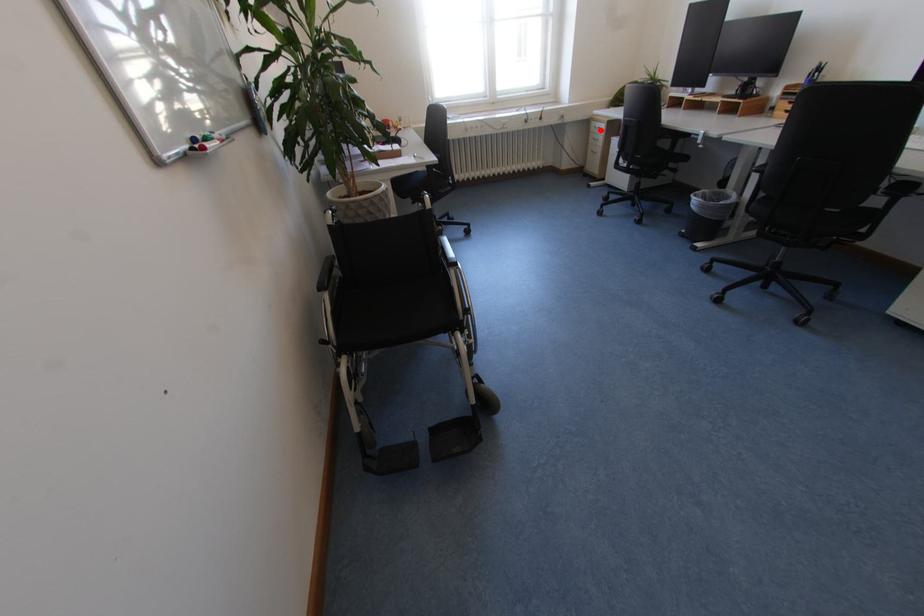
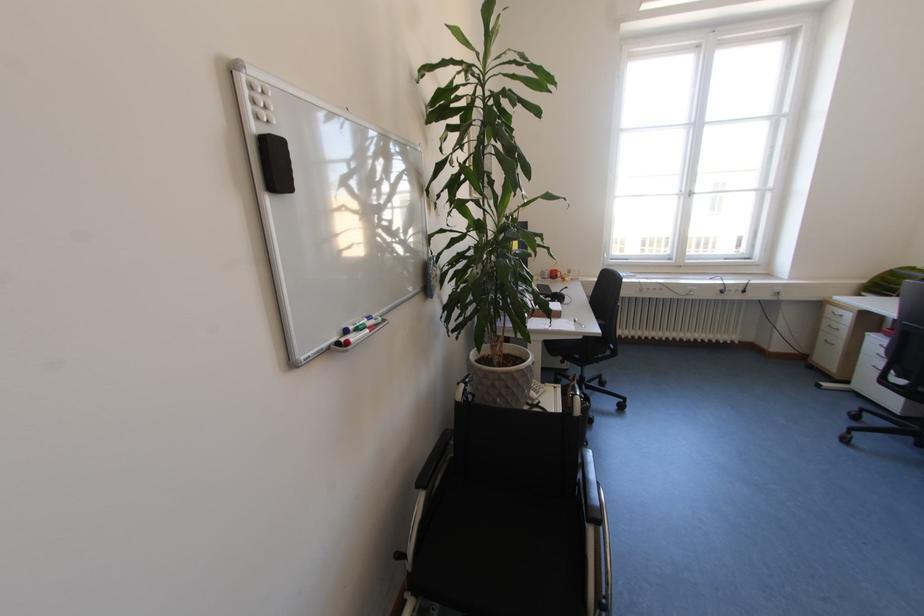
Question: I am providing you with two images of the same scene from different viewpoints. Image1 has a red point marked. In image2, the corresponding 3D location appears at what relative position? Reply with the corresponding letter.

Choices:
 (A) Closer
 (B) Farther

Answer: (B)